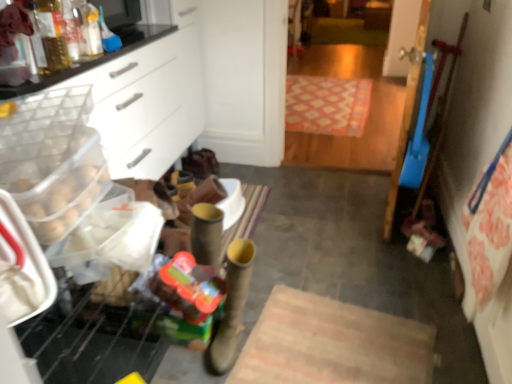
Question: From the image's perspective, is leather boot at center above or below white plastic drawer at left?

Choices:
 (A) above
 (B) below

Answer: (B)

Question: From a real-world perspective, is leather boot at center positioned above or below white plastic drawer at left?

Choices:
 (A) above
 (B) below

Answer: (B)

Question: Which is farther from the leather boot at center?

Choices:
 (A) patterned carpet at center
 (B) translucent plastic toy at lower left
 (C) translucent plastic bottle at upper left
 (D) white plastic drawer at left

Answer: (A)

Question: Which of these objects is positioned farthest from the patterned carpet at center?

Choices:
 (A) white plastic drawer at left
 (B) translucent plastic bottle at upper left
 (C) translucent plastic toy at lower left
 (D) leather boot at center

Answer: (B)